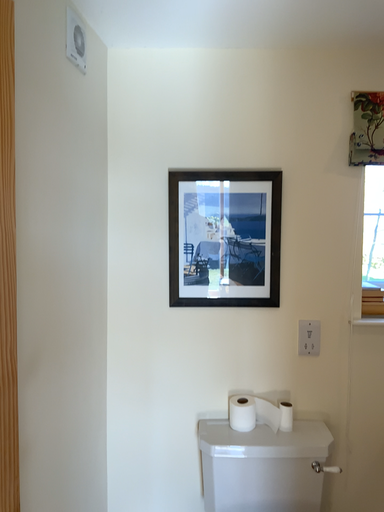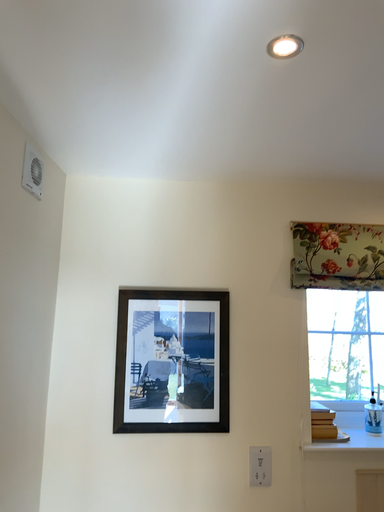
Question: How did the camera likely rotate when shooting the video?

Choices:
 (A) rotated downward
 (B) rotated upward

Answer: (B)